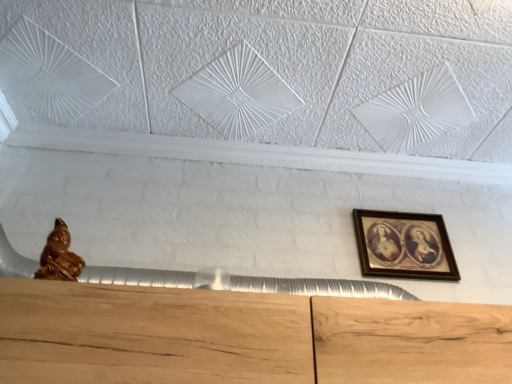
Describe the element at coordinates (59, 256) in the screenshot. I see `gold polished statue at lower left` at that location.

Measure the distance between point (x=75, y=273) and camera.

The depth of point (x=75, y=273) is 84.10 centimeters.

Locate an element on the screen. gold polished statue at lower left is located at coordinates (59, 256).

Describe the element at coordinates (404, 245) in the screenshot. This screenshot has height=384, width=512. I see `wooden framed picture at upper right` at that location.

I want to click on wooden framed picture at upper right, so click(404, 245).

Find the location of a particular element. gold polished statue at lower left is located at coordinates (59, 256).

In the image, is wooden framed picture at upper right on the left side or the right side of gold polished statue at lower left?

In the image, wooden framed picture at upper right appears on the right side of gold polished statue at lower left.

Between wooden framed picture at upper right and gold polished statue at lower left, which one is positioned behind?

wooden framed picture at upper right is further from the camera.

Considering the positions of point (366, 229) and point (50, 254), is point (366, 229) closer or farther from the camera than point (50, 254)?

Point (366, 229).

From the image's perspective, is wooden framed picture at upper right below gold polished statue at lower left?

Indeed, from the image's perspective, wooden framed picture at upper right is shown beneath gold polished statue at lower left.

From a real-world perspective, which is physically above, wooden framed picture at upper right or gold polished statue at lower left?

From a 3D spatial view, wooden framed picture at upper right is above.

Considering the sizes of objects wooden framed picture at upper right and gold polished statue at lower left in the image provided, who is wider, wooden framed picture at upper right or gold polished statue at lower left?

gold polished statue at lower left.

In the scene shown: Is wooden framed picture at upper right taller or shorter than gold polished statue at lower left?

wooden framed picture at upper right is taller than gold polished statue at lower left.

Considering the sizes of wooden framed picture at upper right and gold polished statue at lower left in the image, is wooden framed picture at upper right bigger or smaller than gold polished statue at lower left?

wooden framed picture at upper right is bigger than gold polished statue at lower left.

Would you say wooden framed picture at upper right is inside or outside gold polished statue at lower left?

wooden framed picture at upper right cannot be found inside gold polished statue at lower left.

Is there a large distance between wooden framed picture at upper right and gold polished statue at lower left?

No, wooden framed picture at upper right is not far from gold polished statue at lower left.

Could you tell me if wooden framed picture at upper right is facing gold polished statue at lower left?

No, wooden framed picture at upper right is not turned towards gold polished statue at lower left.

The height and width of the screenshot is (384, 512). In order to click on sculpture on the left of wooden framed picture at upper right in this screenshot , I will do `click(59, 256)`.

Considering the positions of objects gold polished statue at lower left and wooden framed picture at upper right in the image provided, who is more to the left, gold polished statue at lower left or wooden framed picture at upper right?

gold polished statue at lower left is more to the left.

Does gold polished statue at lower left lie behind wooden framed picture at upper right?

No, gold polished statue at lower left is closer to the viewer.

Is point (48, 271) closer to viewer compared to point (432, 252)?

That is True.

From the image's perspective, is gold polished statue at lower left beneath wooden framed picture at upper right?

No, from the image's perspective, gold polished statue at lower left is not beneath wooden framed picture at upper right.

From the picture: From a real-world perspective, is gold polished statue at lower left physically located above or below wooden framed picture at upper right?

Clearly, from a real-world perspective, gold polished statue at lower left is below wooden framed picture at upper right.

Considering the sizes of gold polished statue at lower left and wooden framed picture at upper right in the image, is gold polished statue at lower left wider or thinner than wooden framed picture at upper right?

Clearly, gold polished statue at lower left has more width compared to wooden framed picture at upper right.

Consider the image. Does gold polished statue at lower left have a greater height compared to wooden framed picture at upper right?

Incorrect, the height of gold polished statue at lower left is not larger of that of wooden framed picture at upper right.

In the scene shown: Which of these two, gold polished statue at lower left or wooden framed picture at upper right, is bigger?

wooden framed picture at upper right is bigger.

Is wooden framed picture at upper right inside gold polished statue at lower left?

Actually, wooden framed picture at upper right is outside gold polished statue at lower left.

Is gold polished statue at lower left placed right next to wooden framed picture at upper right?

No, gold polished statue at lower left is not making contact with wooden framed picture at upper right.

Is gold polished statue at lower left turned away from wooden framed picture at upper right?

No, gold polished statue at lower left is not facing the opposite direction of wooden framed picture at upper right.

Measure the distance between gold polished statue at lower left and wooden framed picture at upper right.

gold polished statue at lower left is 32.87 inches from wooden framed picture at upper right.

Identify the location of picture frame on the right of gold polished statue at lower left. This screenshot has width=512, height=384. tap(404, 245).

Find the location of a particular element. Image resolution: width=512 pixels, height=384 pixels. picture frame on the right of gold polished statue at lower left is located at coordinates (404, 245).

Find the location of `sculpture on the left of the wooden framed picture at upper right`. sculpture on the left of the wooden framed picture at upper right is located at coordinates (59, 256).